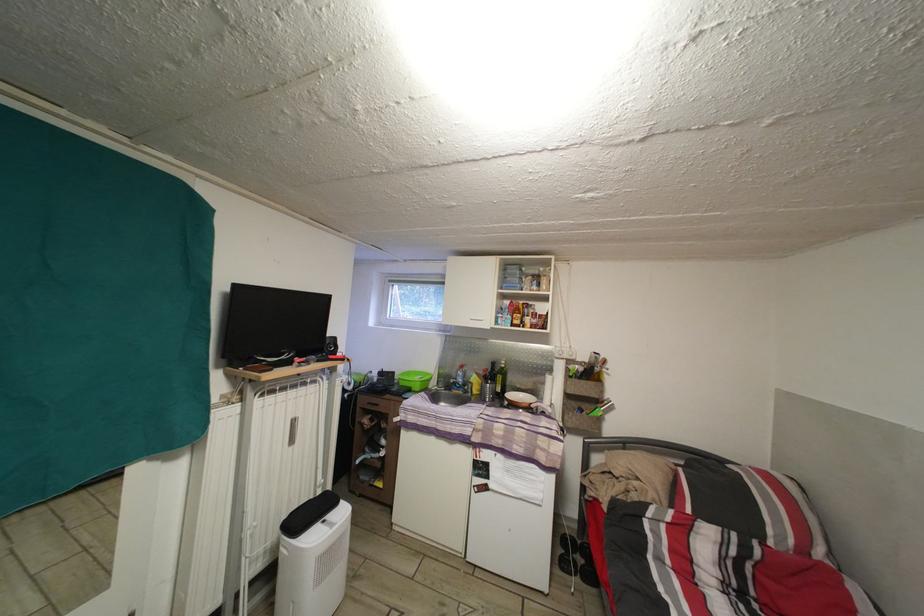
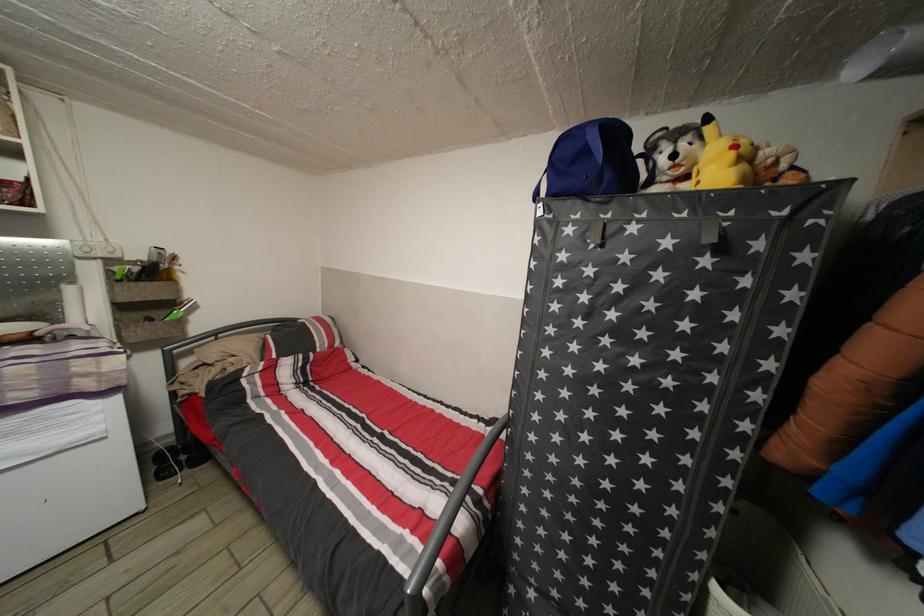
Where in the second image is the point corresponding to the point at 579,546 from the first image?

(177, 455)